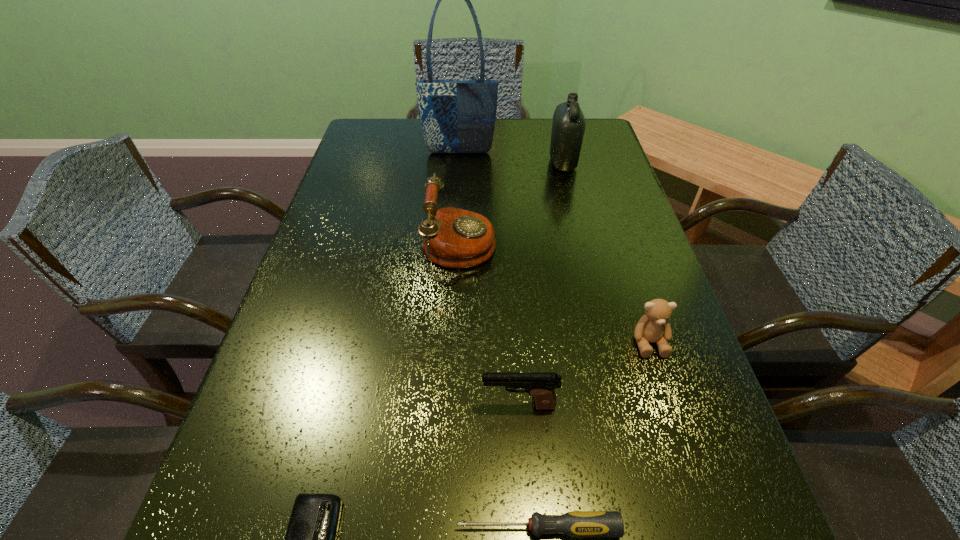
The width and height of the screenshot is (960, 540). I want to click on vacant space located 0.260m on the dial of the telephone, so click(x=609, y=252).

This screenshot has width=960, height=540. I want to click on free space located 0.230m on the face of the teddy bear, so pos(697,490).

This screenshot has width=960, height=540. I want to click on vacant space located at the barrel of the third nearest object, so click(388, 406).

Find the location of `free region located at the barrel of the third nearest object`. free region located at the barrel of the third nearest object is located at coordinates (394, 406).

Locate an element on the screen. This screenshot has width=960, height=540. vacant space located at the barrel of the third nearest object is located at coordinates (258, 406).

You are a GUI agent. You are given a task and a screenshot of the screen. Output one action in this format:
    pyautogui.click(x=<x>, y=<y>)
    Task: Click on the shopping bag located in the far edge section of the desktop
    The width and height of the screenshot is (960, 540).
    Given the screenshot: What is the action you would take?
    pyautogui.click(x=457, y=116)

Find the location of `bottle that is at the far edge`. bottle that is at the far edge is located at coordinates (568, 127).

The image size is (960, 540). Identify the location of bottle located in the right edge section of the desktop. (568, 127).

Locate an element on the screen. teddy bear located at the right edge is located at coordinates (x=652, y=327).

This screenshot has height=540, width=960. Find the location of `object present at the far right corner`. object present at the far right corner is located at coordinates [568, 127].